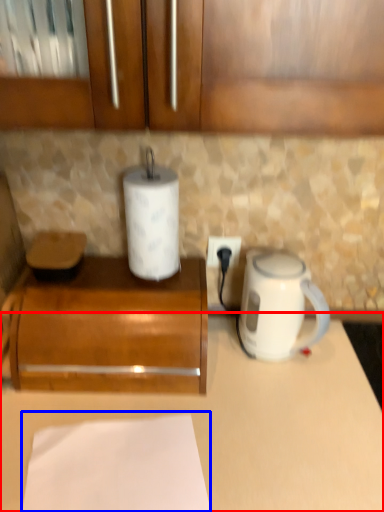
Question: Among these objects, which one is nearest to the camera, counter (highlighted by a red box) or sheet (highlighted by a blue box)?

Choices:
 (A) counter
 (B) sheet

Answer: (B)